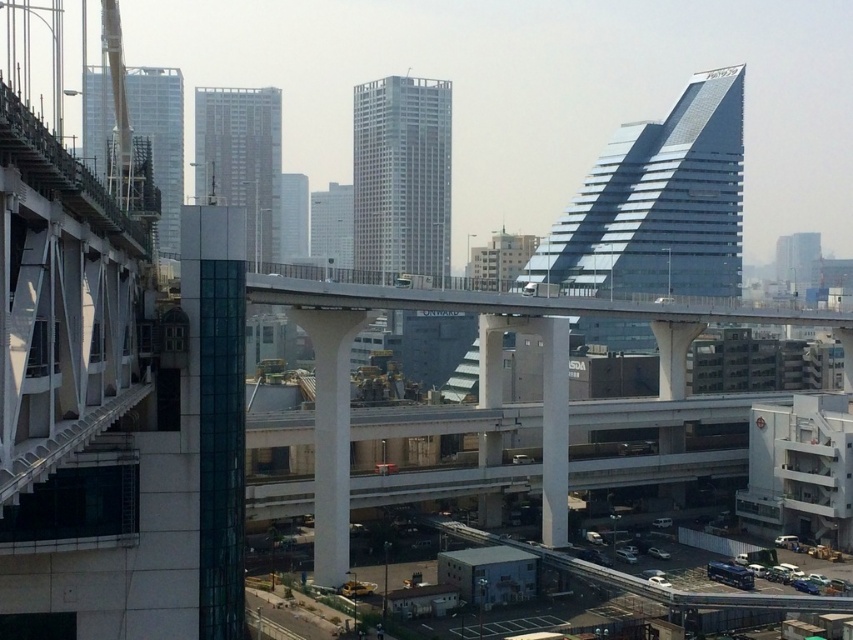
Question: Is the position of smooth glass skyscraper at center less distant than that of white glass skyscraper at center?

Choices:
 (A) yes
 (B) no

Answer: (A)

Question: Is concrete bridge at center closer to the viewer compared to glassy reflective skyscraper at center?

Choices:
 (A) yes
 (B) no

Answer: (A)

Question: Which point appears farthest from the camera in this image?

Choices:
 (A) (325, 374)
 (B) (364, 90)
 (C) (296, 234)

Answer: (C)

Question: Among these points, which one is nearest to the camera?

Choices:
 (A) (271, 260)
 (B) (347, 490)

Answer: (B)

Question: Which of these objects is positioned farthest from the gray glass skyscraper at center?

Choices:
 (A) concrete bridge at center
 (B) white glass skyscraper at center
 (C) glassy reflective skyscraper at center

Answer: (A)

Question: Observing the image, what is the correct spatial positioning of clear glass skyscraper at upper left in reference to glassy reflective skyscraper at center?

Choices:
 (A) right
 (B) left

Answer: (B)